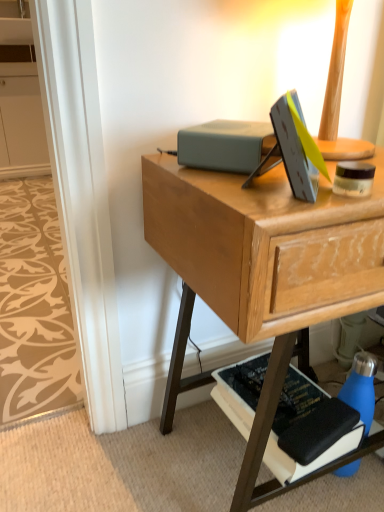
Describe the element at coordinates (294, 422) in the screenshot. I see `black matte book at lower right, which is the first paperback book in bottom-to-top order` at that location.

The image size is (384, 512). Describe the element at coordinates (225, 145) in the screenshot. I see `matte gray book at center, which is counted as the first paperback book, starting from the top` at that location.

Identify the location of wooden desk at center. (261, 270).

Measure the distance between beige patterned carpet at lower left and camera.

37.27 inches.

Measure the distance between point (66, 296) and camera.

The depth of point (66, 296) is 4.53 feet.

I want to click on blue matte water bottle at lower right, so click(361, 387).

Is black matte book at lower right, the second paperback book positioned from the top, not inside matte gray book at center, positioned as the 2th paperback book in bottom-to-top order?

Indeed, black matte book at lower right, the second paperback book positioned from the top, is completely outside matte gray book at center, positioned as the 2th paperback book in bottom-to-top order.

Can you confirm if black matte book at lower right, the second paperback book positioned from the top, is thinner than matte gray book at center, positioned as the 2th paperback book in bottom-to-top order?

No, black matte book at lower right, the second paperback book positioned from the top, is not thinner than matte gray book at center, positioned as the 2th paperback book in bottom-to-top order.

Considering the positions of objects black matte book at lower right, the second paperback book positioned from the top, and matte gray book at center, positioned as the 2th paperback book in bottom-to-top order, in the image provided, who is behind, black matte book at lower right, the second paperback book positioned from the top, or matte gray book at center, positioned as the 2th paperback book in bottom-to-top order,?

black matte book at lower right, the second paperback book positioned from the top, is behind.

From a real-world perspective, does black matte book at lower right, the second paperback book positioned from the top, sit lower than matte gray book at center, which is counted as the first paperback book, starting from the top?

Yes, from a real-world perspective, black matte book at lower right, the second paperback book positioned from the top, is below matte gray book at center, which is counted as the first paperback book, starting from the top.

From a real-world perspective, is wooden desk at center physically above black matte book at lower right, which is the first paperback book in bottom-to-top order?

Yes, from a real-world perspective, wooden desk at center is above black matte book at lower right, which is the first paperback book in bottom-to-top order.

From their relative heights in the image, would you say wooden desk at center is taller or shorter than black matte book at lower right, the second paperback book positioned from the top?

wooden desk at center is taller than black matte book at lower right, the second paperback book positioned from the top.

Looking at this image, from the image's perspective, which one is positioned higher, wooden desk at center or black matte book at lower right, which is the first paperback book in bottom-to-top order?

wooden desk at center is shown above in the image.

Considering the positions of point (49, 327) and point (312, 399), is point (49, 327) closer or farther from the camera than point (312, 399)?

Point (49, 327).

Measure the distance between beige patterned carpet at lower left and black matte book at lower right, the second paperback book positioned from the top.

A distance of 27.76 inches exists between beige patterned carpet at lower left and black matte book at lower right, the second paperback book positioned from the top.

Looking at this image, is beige patterned carpet at lower left outside of black matte book at lower right, the second paperback book positioned from the top?

Yes.

What's the angular difference between beige patterned carpet at lower left and black matte book at lower right, the second paperback book positioned from the top,'s facing directions?

4.31 degrees separate the facing orientations of beige patterned carpet at lower left and black matte book at lower right, the second paperback book positioned from the top.

From a real-world perspective, is black matte book at lower right, which is the first paperback book in bottom-to-top order, under white matte cabinet at upper left?

Yes, from a real-world perspective, black matte book at lower right, which is the first paperback book in bottom-to-top order, is under white matte cabinet at upper left.

Considering the positions of point (253, 389) and point (26, 103), is point (253, 389) closer or farther from the camera than point (26, 103)?

Point (253, 389) is positioned closer to the camera compared to point (26, 103).

Is black matte book at lower right, which is the first paperback book in bottom-to-top order, next to white matte cabinet at upper left and touching it?

No, black matte book at lower right, which is the first paperback book in bottom-to-top order, is not with white matte cabinet at upper left.

From the image's perspective, is black matte book at lower right, which is the first paperback book in bottom-to-top order, above or below white matte cabinet at upper left?

black matte book at lower right, which is the first paperback book in bottom-to-top order, is situated lower than white matte cabinet at upper left in the image.

Is black matte book at lower right, which is the first paperback book in bottom-to-top order, looking in the opposite direction of wooden desk at center?

Yes, black matte book at lower right, which is the first paperback book in bottom-to-top order, is facing away from wooden desk at center.

Which is behind, black matte book at lower right, the second paperback book positioned from the top, or wooden desk at center?

Positioned behind is black matte book at lower right, the second paperback book positioned from the top.

Which of these two, black matte book at lower right, which is the first paperback book in bottom-to-top order, or wooden desk at center, stands taller?

With more height is wooden desk at center.

At what (x,y) coordinates should I click in order to perform the action: click on bottle lying in front of the beige patterned carpet at lower left. Please return your answer as a coordinate pair (x, y). This screenshot has height=512, width=384. Looking at the image, I should click on (361, 387).

Could you tell me if beige patterned carpet at lower left is facing blue matte water bottle at lower right?

No.

From the image's perspective, is beige patterned carpet at lower left beneath blue matte water bottle at lower right?

No, from the image's perspective, beige patterned carpet at lower left is not below blue matte water bottle at lower right.

Could you tell me if matte gray book at center, positioned as the 2th paperback book in bottom-to-top order, is facing beige patterned carpet at lower left?

No, matte gray book at center, positioned as the 2th paperback book in bottom-to-top order, is not turned towards beige patterned carpet at lower left.

Is matte gray book at center, which is counted as the first paperback book, starting from the top, taller or shorter than beige patterned carpet at lower left?

matte gray book at center, which is counted as the first paperback book, starting from the top, is taller than beige patterned carpet at lower left.

How different are the orientations of matte gray book at center, positioned as the 2th paperback book in bottom-to-top order, and beige patterned carpet at lower left in degrees?

The facing directions of matte gray book at center, positioned as the 2th paperback book in bottom-to-top order, and beige patterned carpet at lower left are 39 degrees apart.

Measure the distance between matte gray book at center, which is counted as the first paperback book, starting from the top, and beige patterned carpet at lower left.

matte gray book at center, which is counted as the first paperback book, starting from the top, is 1.05 meters from beige patterned carpet at lower left.

Where is `paperback book located behind the matte gray book at center, positioned as the 2th paperback book in bottom-to-top order`? The height and width of the screenshot is (512, 384). paperback book located behind the matte gray book at center, positioned as the 2th paperback book in bottom-to-top order is located at coordinates (294, 422).

Where is `desk in front of the black matte book at lower right, which is the first paperback book in bottom-to-top order`? The height and width of the screenshot is (512, 384). desk in front of the black matte book at lower right, which is the first paperback book in bottom-to-top order is located at coordinates (261, 270).

Estimate the real-world distances between objects in this image. Which object is further from beige patterned carpet at lower left, matte gray book at center, which is counted as the first paperback book, starting from the top, or wooden desk at center?

matte gray book at center, which is counted as the first paperback book, starting from the top, is positioned further to the anchor beige patterned carpet at lower left.

Based on their spatial positions, is blue matte water bottle at lower right or white matte cabinet at upper left further from matte gray book at center, which is counted as the first paperback book, starting from the top?

white matte cabinet at upper left is further to matte gray book at center, which is counted as the first paperback book, starting from the top.

From the picture: Based on their spatial positions, is white matte cabinet at upper left or wooden desk at center closer to beige patterned carpet at lower left?

wooden desk at center is positioned closer to the anchor beige patterned carpet at lower left.

When comparing their distances from white matte cabinet at upper left, does black matte book at lower right, which is the first paperback book in bottom-to-top order, or blue matte water bottle at lower right seem further?

The object further to white matte cabinet at upper left is blue matte water bottle at lower right.

Estimate the real-world distances between objects in this image. Which object is closer to matte gray book at center, positioned as the 2th paperback book in bottom-to-top order, black matte book at lower right, the second paperback book positioned from the top, or beige patterned carpet at lower left?

black matte book at lower right, the second paperback book positioned from the top, is closer to matte gray book at center, positioned as the 2th paperback book in bottom-to-top order.

Based on their spatial positions, is matte gray book at center, which is counted as the first paperback book, starting from the top, or wooden desk at center further from white matte cabinet at upper left?

Based on the image, matte gray book at center, which is counted as the first paperback book, starting from the top, appears to be further to white matte cabinet at upper left.

Considering their positions, is white matte cabinet at upper left positioned closer to blue matte water bottle at lower right than black matte book at lower right, the second paperback book positioned from the top?

black matte book at lower right, the second paperback book positioned from the top, is positioned closer to the anchor blue matte water bottle at lower right.

Estimate the real-world distances between objects in this image. Which object is closer to white matte cabinet at upper left, wooden desk at center or blue matte water bottle at lower right?

wooden desk at center lies closer to white matte cabinet at upper left than the other object.

At what (x,y) coordinates should I click in order to perform the action: click on pattern between black matte book at lower right, the second paperback book positioned from the top, and white matte cabinet at upper left in the front-back direction. Please return your answer as a coordinate pair (x, y). The height and width of the screenshot is (512, 384). Looking at the image, I should click on (34, 305).

Locate an element on the screen. Image resolution: width=384 pixels, height=512 pixels. pattern between blue matte water bottle at lower right and white matte cabinet at upper left along the z-axis is located at coordinates (34, 305).

The width and height of the screenshot is (384, 512). Identify the location of paperback book between matte gray book at center, positioned as the 2th paperback book in bottom-to-top order, and blue matte water bottle at lower right vertically. (294, 422).

Identify the location of pattern between matte gray book at center, which is counted as the first paperback book, starting from the top, and white matte cabinet at upper left, along the z-axis. Image resolution: width=384 pixels, height=512 pixels. (34, 305).